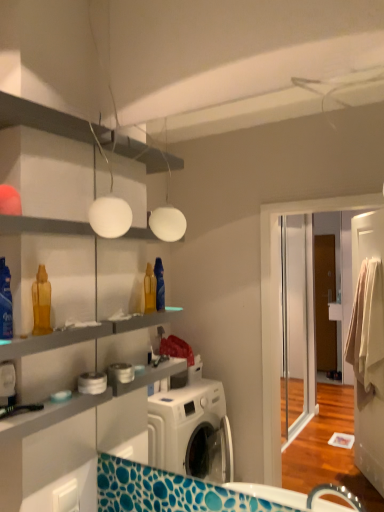
At what (x,y) coordinates should I click in order to perform the action: click on translucent plastic bottle at left, acting as the first cleaning product starting from the back. Please return your answer as a coordinate pair (x, y). Image resolution: width=384 pixels, height=512 pixels. Looking at the image, I should click on (41, 302).

The width and height of the screenshot is (384, 512). In order to click on translucent plastic spray bottle at left, placed as the first cleaning product when sorted from left to right in this screenshot , I will do `click(5, 302)`.

Is translucent plastic bottle at left, positioned as the 1th cleaning product in right-to-left order, inside translucent plastic spray bottle at left, the 1th cleaning product when ordered from front to back?

No, translucent plastic bottle at left, positioned as the 1th cleaning product in right-to-left order, is located outside of translucent plastic spray bottle at left, the 1th cleaning product when ordered from front to back.

Would you consider translucent plastic spray bottle at left, the second cleaning product viewed from the right, to be distant from translucent plastic bottle at left, arranged as the 2th cleaning product when viewed from the left?

No, translucent plastic spray bottle at left, the second cleaning product viewed from the right, is in close proximity to translucent plastic bottle at left, arranged as the 2th cleaning product when viewed from the left.

Looking at their sizes, would you say translucent plastic spray bottle at left, the 1th cleaning product when ordered from front to back, is wider or thinner than translucent plastic bottle at left, arranged as the 2th cleaning product when viewed from the left?

Considering their sizes, translucent plastic spray bottle at left, the 1th cleaning product when ordered from front to back, looks slimmer than translucent plastic bottle at left, arranged as the 2th cleaning product when viewed from the left.

Does translucent plastic spray bottle at left, the 1th cleaning product when ordered from front to back, have a smaller size compared to translucent plastic bottle at left, acting as the first cleaning product starting from the back?

No, translucent plastic spray bottle at left, the 1th cleaning product when ordered from front to back, is not smaller than translucent plastic bottle at left, acting as the first cleaning product starting from the back.

Identify the location of cleaning product behind the white matte globe at upper center. This screenshot has height=512, width=384. (41, 302).

Is white matte globe at upper center facing towards translucent plastic bottle at left, arranged as the 2th cleaning product when viewed from the left?

No, white matte globe at upper center does not turn towards translucent plastic bottle at left, arranged as the 2th cleaning product when viewed from the left.

Are white matte globe at upper center and translucent plastic bottle at left, the second cleaning product from the front, located far from each other?

white matte globe at upper center is near translucent plastic bottle at left, the second cleaning product from the front, not far away.

What's the angular difference between white matte globe at upper center and translucent plastic bottle at left, arranged as the 2th cleaning product when viewed from the left,'s facing directions?

The angle between the facing direction of white matte globe at upper center and the facing direction of translucent plastic bottle at left, arranged as the 2th cleaning product when viewed from the left, is 89.5 degrees.

Is translucent plastic spray bottle at left, the second cleaning product viewed from the right, outside of white matte globe at upper center?

Yes, translucent plastic spray bottle at left, the second cleaning product viewed from the right, is not within white matte globe at upper center.

Considering the sizes of objects translucent plastic spray bottle at left, the 1th cleaning product when ordered from front to back, and white matte globe at upper center in the image provided, who is shorter, translucent plastic spray bottle at left, the 1th cleaning product when ordered from front to back, or white matte globe at upper center?

translucent plastic spray bottle at left, the 1th cleaning product when ordered from front to back, is shorter.

From a real-world perspective, is translucent plastic spray bottle at left, the second cleaning product viewed from the right, over white matte globe at upper center?

No, from a real-world perspective, translucent plastic spray bottle at left, the second cleaning product viewed from the right, is not above white matte globe at upper center.

Relative to white matte globe at upper center, is translucent plastic spray bottle at left, the second cleaning product viewed from the right, in front or behind?

translucent plastic spray bottle at left, the second cleaning product viewed from the right, is in front of white matte globe at upper center.

Is translucent plastic bottle at left, the second cleaning product from the front, positioned far away from white matte globe at upper center?

They are positioned close to each other.

From a real-world perspective, is translucent plastic bottle at left, the second cleaning product from the front, located higher than white matte globe at upper center?

No.

What are the coordinates of `light fixture located above the translucent plastic bottle at left, acting as the first cleaning product starting from the back (from a real-world perspective)` in the screenshot? It's located at (109, 208).

Would you say translucent plastic bottle at left, arranged as the 2th cleaning product when viewed from the left, is a long distance from translucent plastic spray bottle at left, the 1th cleaning product when ordered from front to back?

They are positioned close to each other.

Considering the sizes of objects translucent plastic bottle at left, arranged as the 2th cleaning product when viewed from the left, and translucent plastic spray bottle at left, the 1th cleaning product when ordered from front to back, in the image provided, who is smaller, translucent plastic bottle at left, arranged as the 2th cleaning product when viewed from the left, or translucent plastic spray bottle at left, the 1th cleaning product when ordered from front to back,?

With smaller size is translucent plastic bottle at left, arranged as the 2th cleaning product when viewed from the left.

Considering the relative sizes of translucent plastic bottle at left, acting as the first cleaning product starting from the back, and translucent plastic spray bottle at left, the 1th cleaning product when ordered from front to back, in the image provided, is translucent plastic bottle at left, acting as the first cleaning product starting from the back, taller than translucent plastic spray bottle at left, the 1th cleaning product when ordered from front to back,?

Incorrect, the height of translucent plastic bottle at left, acting as the first cleaning product starting from the back, is not larger of that of translucent plastic spray bottle at left, the 1th cleaning product when ordered from front to back.

Could you tell me if white matte globe at upper center is turned towards translucent plastic spray bottle at left, the second cleaning product viewed from the right?

No, white matte globe at upper center is not turned towards translucent plastic spray bottle at left, the second cleaning product viewed from the right.

From the image's perspective, who appears lower, white matte globe at upper center or translucent plastic spray bottle at left, acting as the second cleaning product starting from the back?

translucent plastic spray bottle at left, acting as the second cleaning product starting from the back.

Is white matte globe at upper center beside translucent plastic spray bottle at left, the 1th cleaning product when ordered from front to back?

white matte globe at upper center and translucent plastic spray bottle at left, the 1th cleaning product when ordered from front to back, are clearly separated.

From their relative heights in the image, would you say white matte globe at upper center is taller or shorter than translucent plastic spray bottle at left, the second cleaning product viewed from the right?

Considering their sizes, white matte globe at upper center has more height than translucent plastic spray bottle at left, the second cleaning product viewed from the right.

At what (x,y) coordinates should I click in order to perform the action: click on cleaning product above the translucent plastic bottle at left, arranged as the 2th cleaning product when viewed from the left (from a real-world perspective). Please return your answer as a coordinate pair (x, y). Looking at the image, I should click on (5, 302).

Identify the location of the 2nd cleaning product positioned below the white matte globe at upper center (from a real-world perspective). (41, 302).

Which object lies further to the anchor point translucent plastic spray bottle at left, acting as the second cleaning product starting from the back, white matte globe at upper center or translucent plastic bottle at left, arranged as the 2th cleaning product when viewed from the left?

white matte globe at upper center is further to translucent plastic spray bottle at left, acting as the second cleaning product starting from the back.

From the image, which object appears to be farther from white matte globe at upper center, translucent plastic spray bottle at left, the second cleaning product viewed from the right, or translucent plastic bottle at left, acting as the first cleaning product starting from the back?

translucent plastic spray bottle at left, the second cleaning product viewed from the right, is further to white matte globe at upper center.

Considering their positions, is translucent plastic spray bottle at left, placed as the first cleaning product when sorted from left to right, positioned further to translucent plastic bottle at left, arranged as the 2th cleaning product when viewed from the left, than white matte globe at upper center?

white matte globe at upper center is positioned further to the anchor translucent plastic bottle at left, arranged as the 2th cleaning product when viewed from the left.

From the image, which object appears to be farther from translucent plastic bottle at left, acting as the first cleaning product starting from the back, white matte globe at upper center or translucent plastic spray bottle at left, the 1th cleaning product when ordered from front to back?

The object further to translucent plastic bottle at left, acting as the first cleaning product starting from the back, is white matte globe at upper center.

Based on their spatial positions, is translucent plastic bottle at left, arranged as the 2th cleaning product when viewed from the left, or white matte globe at upper center closer to translucent plastic spray bottle at left, placed as the first cleaning product when sorted from left to right?

The object closer to translucent plastic spray bottle at left, placed as the first cleaning product when sorted from left to right, is translucent plastic bottle at left, arranged as the 2th cleaning product when viewed from the left.

Which object lies further to the anchor point white matte globe at upper center, translucent plastic bottle at left, the second cleaning product from the front, or translucent plastic spray bottle at left, placed as the first cleaning product when sorted from left to right?

translucent plastic spray bottle at left, placed as the first cleaning product when sorted from left to right.

Find the location of a particular element. cleaning product that lies between white matte globe at upper center and translucent plastic bottle at left, arranged as the 2th cleaning product when viewed from the left, from top to bottom is located at coordinates (5, 302).